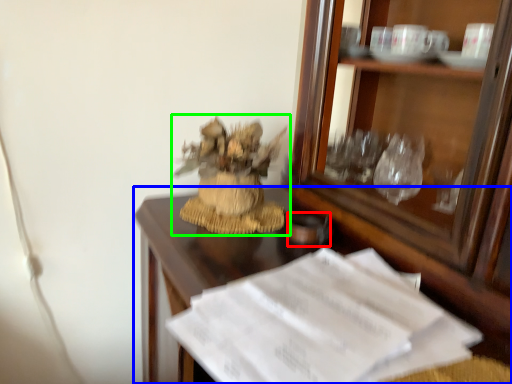
Question: Estimate the real-world distances between objects in this image. Which object is farther from tableware (highlighted by a red box), desk (highlighted by a blue box) or houseplant (highlighted by a green box)?

Choices:
 (A) desk
 (B) houseplant

Answer: (A)